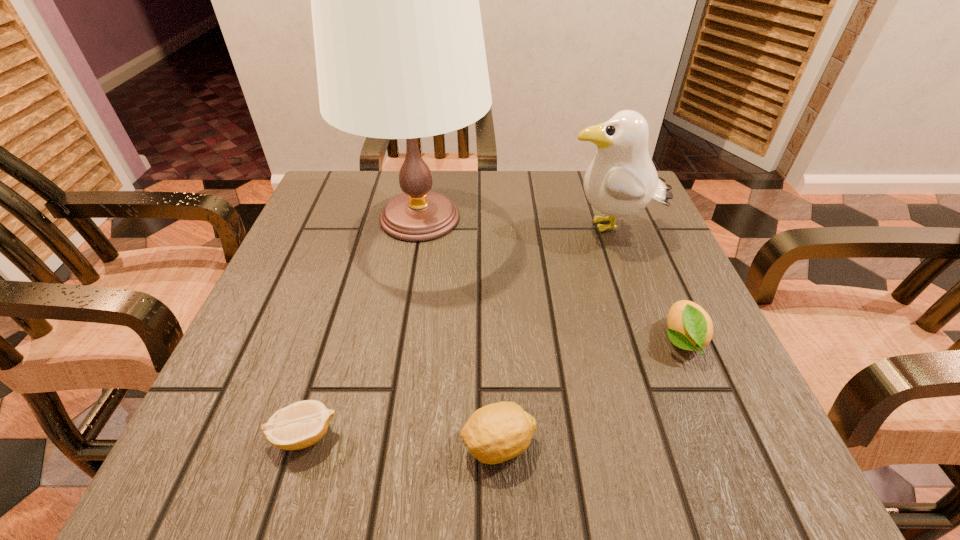
Identify the location of gull that is at the right edge. Image resolution: width=960 pixels, height=540 pixels. (621, 180).

What are the coordinates of `lemon at the right edge` in the screenshot? It's located at (690, 327).

Where is `object that is at the far left corner`? The width and height of the screenshot is (960, 540). object that is at the far left corner is located at coordinates (399, 46).

The height and width of the screenshot is (540, 960). I want to click on object at the near left corner, so click(x=301, y=424).

Find the location of a particular element. The image size is (960, 540). object located at the far right corner is located at coordinates (621, 180).

Locate an element on the screen. This screenshot has width=960, height=540. vacant area at the far edge is located at coordinates (505, 217).

Locate an element on the screen. blank space at the near edge of the desktop is located at coordinates (404, 438).

This screenshot has width=960, height=540. I want to click on vacant space at the left edge of the desktop, so click(x=284, y=251).

Where is `free space at the right edge`? The width and height of the screenshot is (960, 540). free space at the right edge is located at coordinates (630, 256).

Image resolution: width=960 pixels, height=540 pixels. In the image, there is a desktop. Identify the location of vacant space at the far left corner. (327, 216).